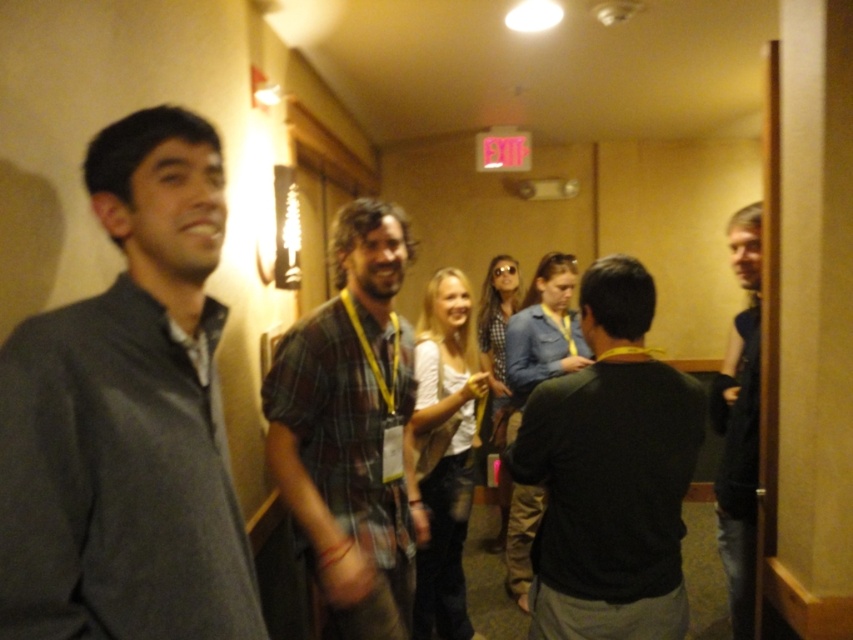
Question: Is matte gray shirt at left positioned in front of dark gray shirt at center?

Choices:
 (A) no
 (B) yes

Answer: (B)

Question: Which is nearer to the dark gray shirt at center?

Choices:
 (A) dark blue sweater at right
 (B) matte gray shirt at left
 (C) plaid fabric shirt at center

Answer: (C)

Question: Is dark gray shirt at center to the right of dark blue sweater at right from the viewer's perspective?

Choices:
 (A) yes
 (B) no

Answer: (B)

Question: Which of the following is the farthest from the observer?

Choices:
 (A) dark gray shirt at center
 (B) dark blue sweater at right
 (C) matte gray shirt at left
 (D) plaid fabric shirt at center

Answer: (B)

Question: Is dark gray shirt at center to the right of plaid fabric shirt at center from the viewer's perspective?

Choices:
 (A) no
 (B) yes

Answer: (B)

Question: Considering the real-world distances, which object is farthest from the plaid fabric shirt at center?

Choices:
 (A) dark blue sweater at right
 (B) matte gray shirt at left
 (C) dark gray shirt at center

Answer: (A)